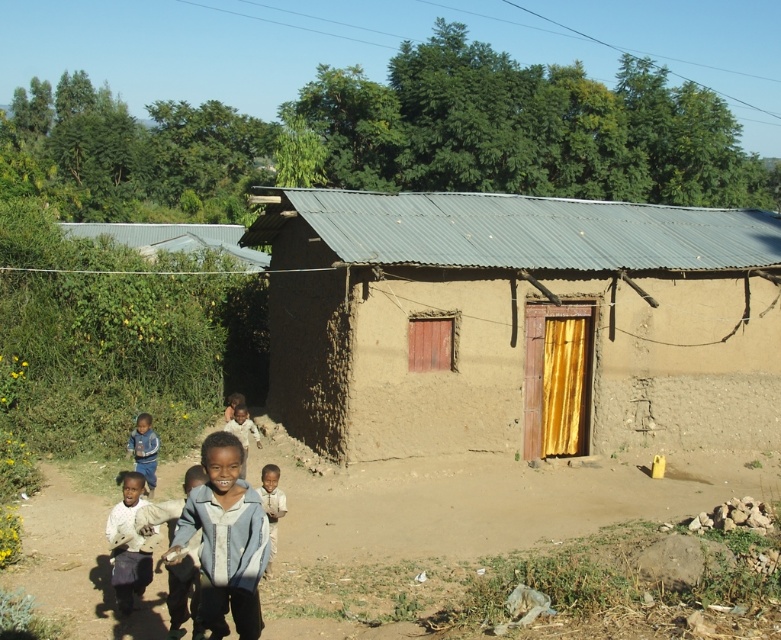
Looking at this image, you are a photographer trying to capture a photo of the light blue denim jacket at lower center and the light brown skin at lower center. Since you want both subjects to appear equally sized in the photo, which subject should you move closer to? Please explain your reasoning based on their sizes.

The light blue denim jacket at lower center is bigger than the light brown skin at lower center. To make them appear the same size in the photo, you should move closer to the light brown skin at lower center. This is because the smaller object needs to be closer to the camera to compensate for its size difference, while the larger object can be slightly farther away.

From the picture: You are standing at point (269,488) and want to walk to the house in the scene. Which direction should you move relative to point (216,548)?

You should move towards point (216,548) because it is in front of point (269,488), so moving towards it will lead you closer to the house.

Looking at this image, you are standing in front of the small mud brick house and want to take a photo. There are two points in the scene marked as point 1 at coordinates point (209, 577) and point 2 at coordinates point (152, 438). Which point should you focus on to ensure the foreground is sharp?

Point 1 at coordinates point (209, 577) should be focused on because it is closer to the camera, ensuring the foreground elements are in sharp focus.